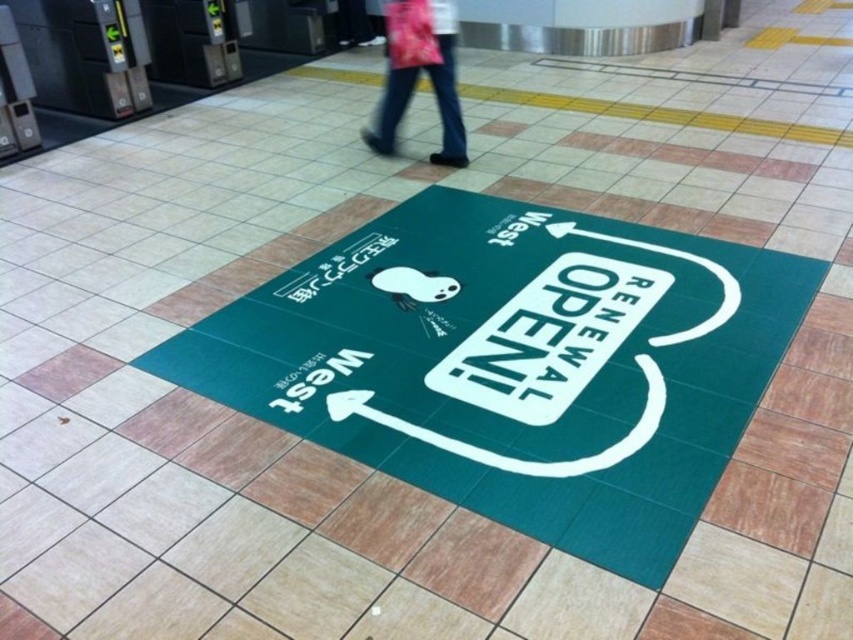
Question: Is green rubber mat at center below pink fabric pants at upper center?

Choices:
 (A) no
 (B) yes

Answer: (B)

Question: Is the position of green rubber mat at center less distant than that of pink fabric pants at upper center?

Choices:
 (A) no
 (B) yes

Answer: (B)

Question: Which point is farther to the camera?

Choices:
 (A) pink fabric pants at upper center
 (B) green rubber mat at center

Answer: (A)

Question: Does green rubber mat at center appear on the right side of pink fabric pants at upper center?

Choices:
 (A) no
 (B) yes

Answer: (B)